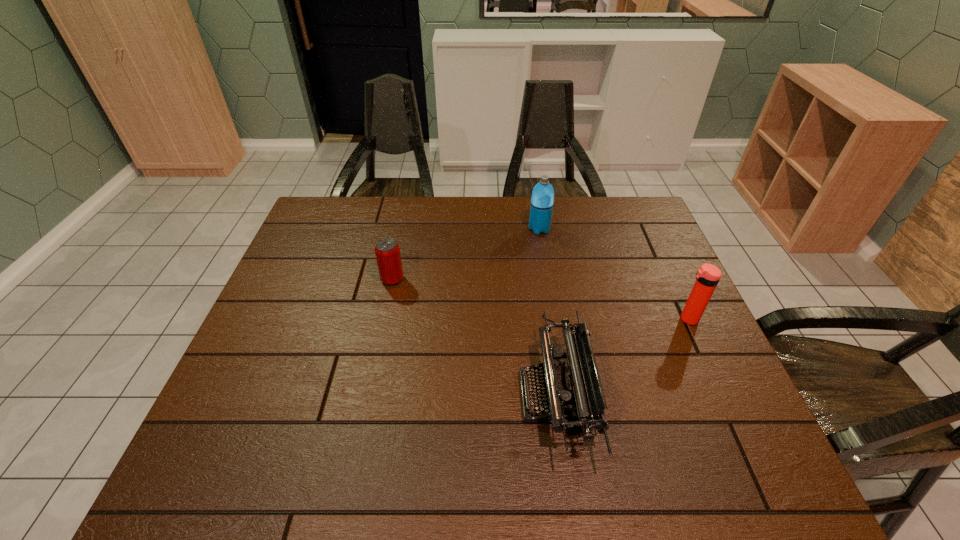
Where is `free space located on the typing side of the typewriter`? The image size is (960, 540). free space located on the typing side of the typewriter is located at coordinates (418, 396).

The width and height of the screenshot is (960, 540). Identify the location of free space located 0.330m on the typing side of the typewriter. (373, 396).

Find the location of a particular element. This screenshot has height=540, width=960. free space located on the typing side of the typewriter is located at coordinates (391, 396).

At what (x,y) coordinates should I click in order to perform the action: click on object that is at the far edge. Please return your answer as a coordinate pair (x, y). This screenshot has height=540, width=960. Looking at the image, I should click on (542, 199).

Where is `object positioned at the near edge`? object positioned at the near edge is located at coordinates (573, 395).

Find the location of a particular element. The height and width of the screenshot is (540, 960). object located in the right edge section of the desktop is located at coordinates (707, 277).

This screenshot has height=540, width=960. Find the location of `free region at the far edge of the desktop`. free region at the far edge of the desktop is located at coordinates (442, 221).

Locate an element on the screen. blank space at the left edge of the desktop is located at coordinates (254, 339).

In the image, there is a desktop. At what (x,y) coordinates should I click in order to perform the action: click on free region at the right edge. Please return your answer as a coordinate pair (x, y). Image resolution: width=960 pixels, height=540 pixels. Looking at the image, I should click on (710, 344).

Locate an element on the screen. This screenshot has height=540, width=960. vacant space at the far left corner is located at coordinates (311, 233).